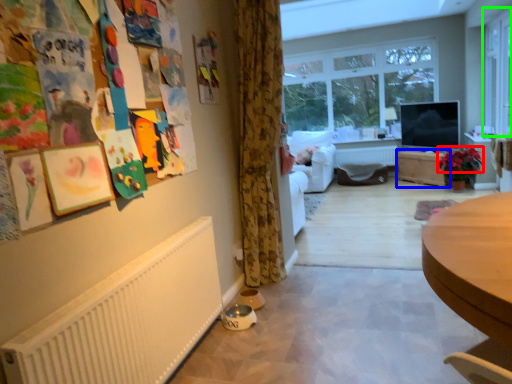
Question: Which is farther away from flower (highlighted by a red box)? table (highlighted by a blue box) or window (highlighted by a green box)?

Choices:
 (A) table
 (B) window

Answer: (B)